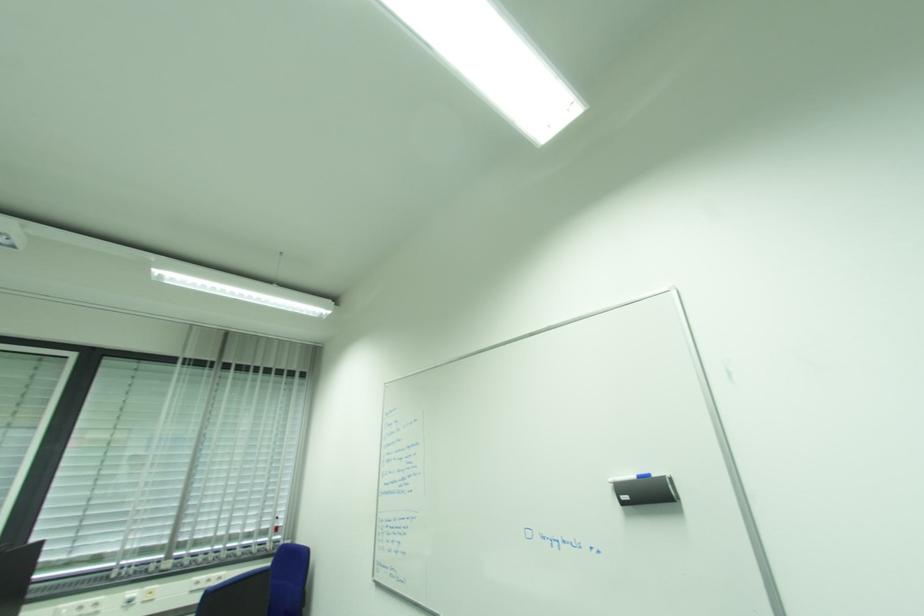
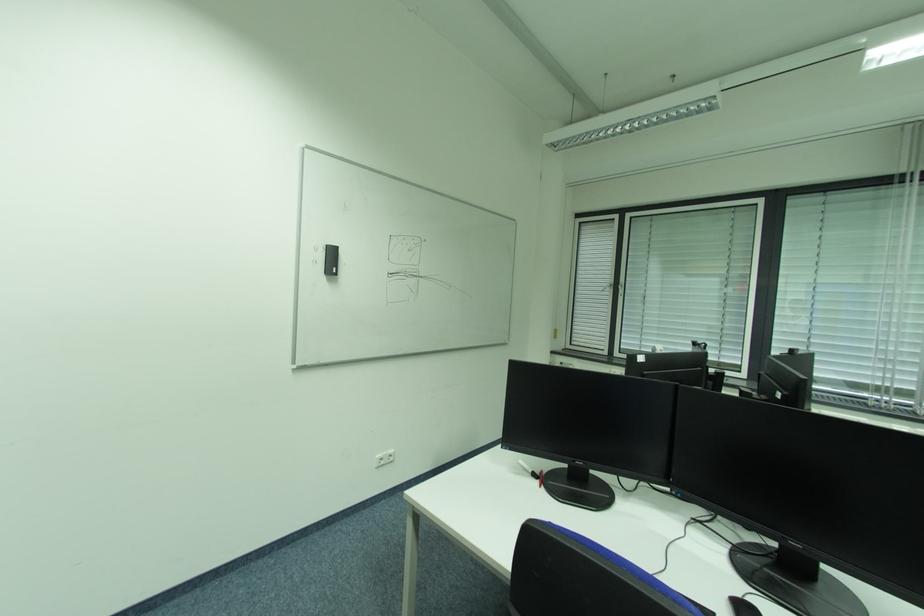
Question: The first image is from the beginning of the video and the second image is from the end. How did the camera likely rotate when shooting the video?

Choices:
 (A) Left
 (B) Right
 (C) Up
 (D) Down

Answer: (A)